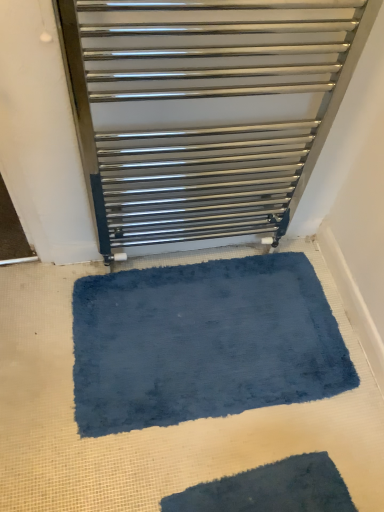
At what (x,y) coordinates should I click in order to perform the action: click on vacant space that's between blue plush bath mat at center, which appears as the first bath mat when viewed from the top, and dark blue shaggy bath mat at lower center, positioned as the second bath mat in back-to-front order. Please return your answer as a coordinate pair (x, y). Looking at the image, I should click on (228, 450).